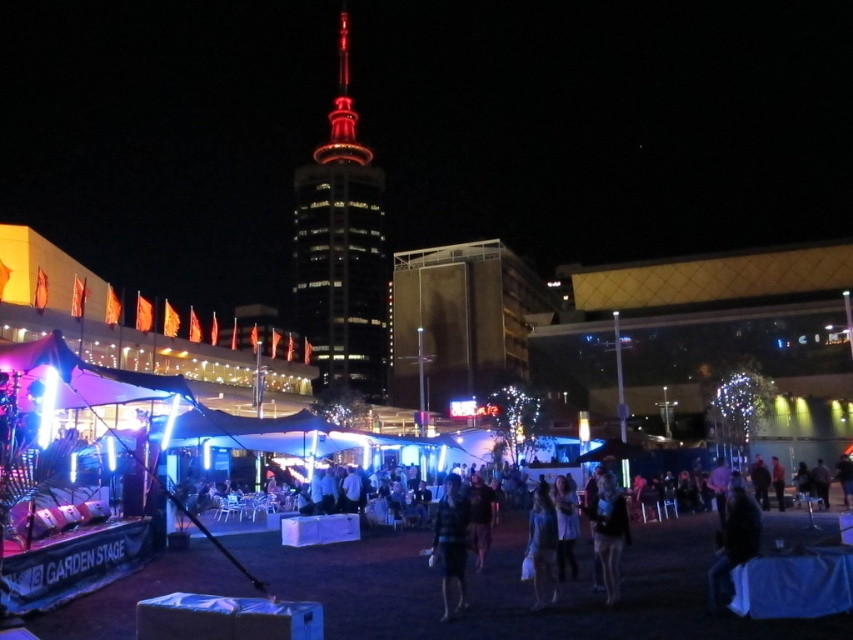
Can you confirm if striped fabric shirt at center is positioned to the left of dark blue fabric at center?

Correct, you'll find striped fabric shirt at center to the left of dark blue fabric at center.

From the picture: Is striped fabric shirt at center further to camera compared to dark blue fabric at center?

No, it is not.

The image size is (853, 640). I want to click on striped fabric shirt at center, so click(451, 541).

Where is `striped fabric shirt at center`? striped fabric shirt at center is located at coordinates (451, 541).

Does shiny glass tower at center have a lesser height compared to striped fabric shirt at center?

In fact, shiny glass tower at center may be taller than striped fabric shirt at center.

Can you confirm if shiny glass tower at center is wider than striped fabric shirt at center?

Yes.

Is point (318, 356) more distant than point (462, 560)?

Yes.

Where is `shiny glass tower at center`? This screenshot has width=853, height=640. shiny glass tower at center is located at coordinates (341, 252).

Does shiny glass tower at center appear on the left side of dark blue fabric at center?

Correct, you'll find shiny glass tower at center to the left of dark blue fabric at center.

Is shiny glass tower at center below dark blue fabric at center?

Incorrect, shiny glass tower at center is not positioned below dark blue fabric at center.

The height and width of the screenshot is (640, 853). What do you see at coordinates (341, 252) in the screenshot? I see `shiny glass tower at center` at bounding box center [341, 252].

Identify the location of shiny glass tower at center. (341, 252).